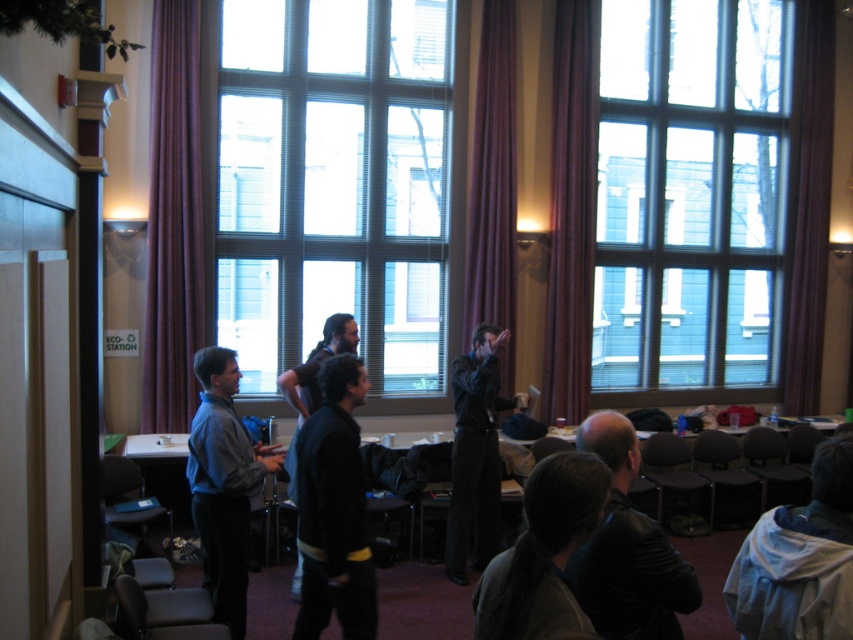
Is purple fabric curtain at right shorter than purple velvet curtain at right?

Indeed, purple fabric curtain at right has a lesser height compared to purple velvet curtain at right.

Between purple fabric curtain at right and purple velvet curtain at right, which one is positioned higher?

Positioned higher is purple velvet curtain at right.

Does point (558, 42) come farther from viewer compared to point (799, 316)?

That is False.

Locate an element on the screen. purple fabric curtain at right is located at coordinates (572, 211).

The width and height of the screenshot is (853, 640). Describe the element at coordinates (572, 211) in the screenshot. I see `purple fabric curtain at right` at that location.

In the scene shown: Is purple fabric curtain at right above dark blue sweater at center?

Yes.

Find the location of a particular element. The height and width of the screenshot is (640, 853). purple fabric curtain at right is located at coordinates (572, 211).

Image resolution: width=853 pixels, height=640 pixels. In order to click on purple fabric curtain at right in this screenshot , I will do `click(572, 211)`.

Is the position of clear glass window at upper right less distant than that of dark gray jacket at lower center?

No, clear glass window at upper right is further to the viewer.

Can you confirm if clear glass window at upper right is positioned below dark gray jacket at lower center?

Incorrect, clear glass window at upper right is not positioned below dark gray jacket at lower center.

Which is in front, point (635, 44) or point (550, 570)?

Point (550, 570) is more forward.

Identify the location of clear glass window at upper right. The width and height of the screenshot is (853, 640). (689, 192).